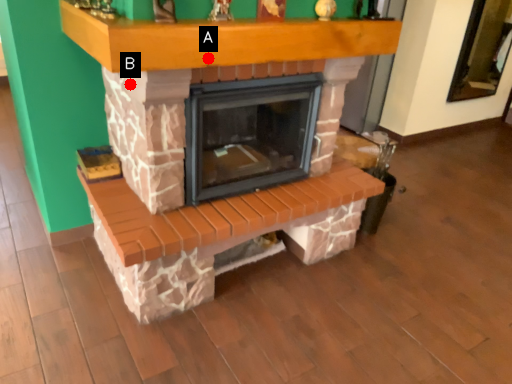
Question: Two points are circled on the image, labeled by A and B beside each circle. Which point appears farthest from the camera in this image?

Choices:
 (A) A is further
 (B) B is further

Answer: (B)